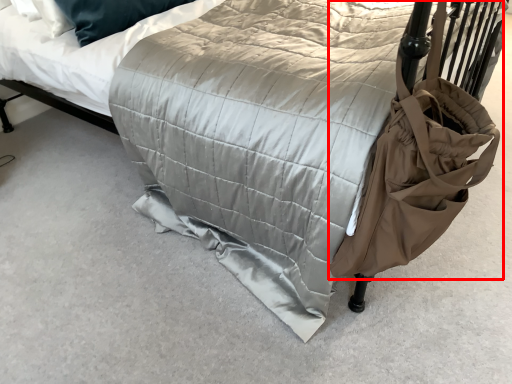
Question: In this image, where is bag (annotated by the red box) located relative to mattress?

Choices:
 (A) left
 (B) right

Answer: (B)